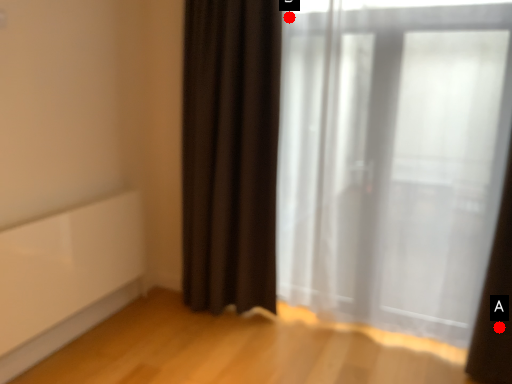
Question: Two points are circled on the image, labeled by A and B beside each circle. Which of the following is the farthest from the observer?

Choices:
 (A) A is further
 (B) B is further

Answer: (B)